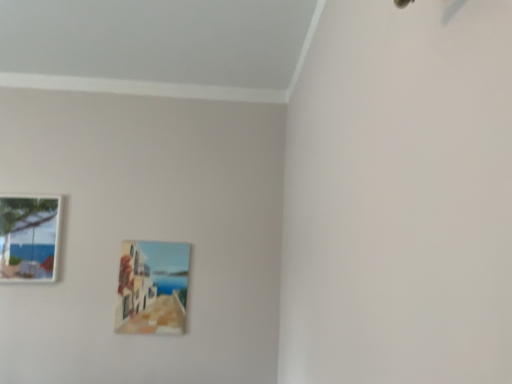
Question: Is point (33, 249) positioned closer to the camera than point (124, 324)?

Choices:
 (A) closer
 (B) farther

Answer: (B)

Question: Based on their sizes in the image, would you say wooden picture frame at lower left, the 1th picture frame when ordered from left to right, is bigger or smaller than matte wooden picture frame at center, which is the 2th picture frame from left to right?

Choices:
 (A) small
 (B) big

Answer: (B)

Question: From the image's perspective, is wooden picture frame at lower left, the 1th picture frame when ordered from left to right, above or below matte wooden picture frame at center, which is the 2th picture frame from left to right?

Choices:
 (A) below
 (B) above

Answer: (B)

Question: From a real-world perspective, is matte wooden picture frame at center, which is the 2th picture frame from left to right, above or below wooden picture frame at lower left, the 1th picture frame when ordered from left to right?

Choices:
 (A) above
 (B) below

Answer: (B)

Question: Considering the relative positions of matte wooden picture frame at center, marked as the first picture frame in a right-to-left arrangement, and wooden picture frame at lower left, the 1th picture frame when ordered from left to right, in the image provided, is matte wooden picture frame at center, marked as the first picture frame in a right-to-left arrangement, to the left or to the right of wooden picture frame at lower left, the 1th picture frame when ordered from left to right,?

Choices:
 (A) right
 (B) left

Answer: (A)

Question: Is matte wooden picture frame at center, marked as the first picture frame in a right-to-left arrangement, in front of or behind wooden picture frame at lower left, the second picture frame when ordered from right to left, in the image?

Choices:
 (A) front
 (B) behind

Answer: (B)

Question: Considering the positions of point (169, 322) and point (15, 233), is point (169, 322) closer or farther from the camera than point (15, 233)?

Choices:
 (A) closer
 (B) farther

Answer: (A)